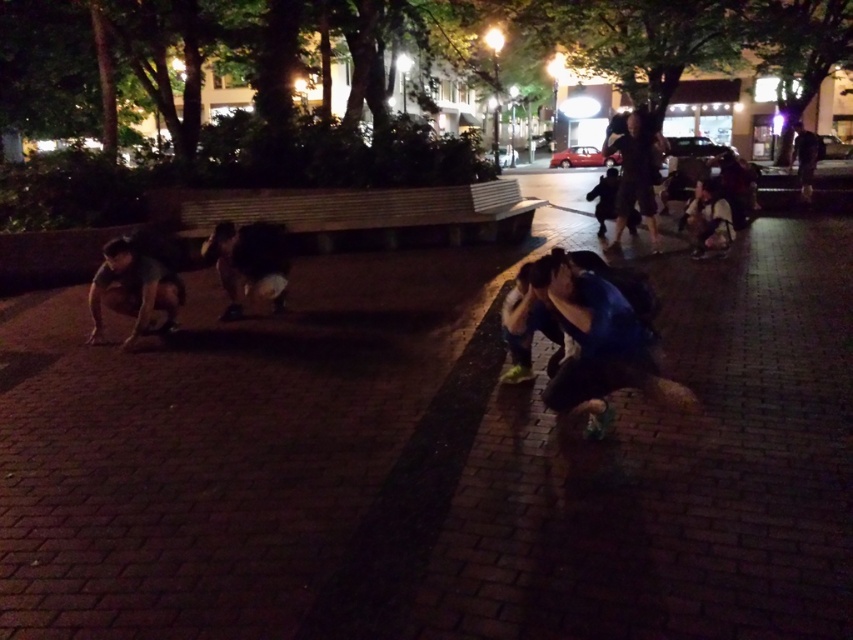
You are standing in the nighttime square and want to walk to the leather jacket at center without stepping on the dark brick pavement at center. Is this possible?

The dark brick pavement at center is in front of the leather jacket at center, so you would have to step on the dark brick pavement at center to reach the leather jacket at center.

In the scene shown: You are a photographer standing at the edge of the square. You want to capture a photo that includes both the blue fabric at lower right and the dark blue fabric pants at center. Given the distance between them, will you need to adjust your camera to a wider angle to ensure both are in frame?

The distance between the blue fabric at lower right and the dark blue fabric pants at center is 10.61 feet. To include both in the frame, you would need to adjust your camera to a wider angle to accommodate the distance between them.

You are standing at the point marked as point (437, 460) in the image. What surface are you currently standing on?

You are standing on dark brick pavement at center.